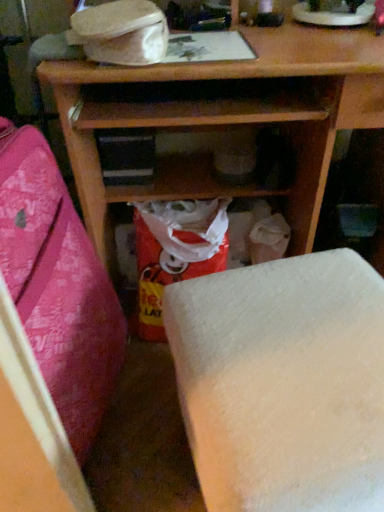
Question: Is matte plastic bag at center surrounded by white matte foam at lower center, which appears as the 2th furniture when viewed from the left?

Choices:
 (A) no
 (B) yes

Answer: (A)

Question: Considering the relative sizes of white matte foam at lower center, placed as the first furniture when sorted from right to left, and matte plastic bag at center in the image provided, is white matte foam at lower center, placed as the first furniture when sorted from right to left, shorter than matte plastic bag at center?

Choices:
 (A) no
 (B) yes

Answer: (A)

Question: Is white matte foam at lower center, placed as the first furniture when sorted from right to left, wider than matte plastic bag at center?

Choices:
 (A) yes
 (B) no

Answer: (A)

Question: Can you confirm if white matte foam at lower center, placed as the first furniture when sorted from right to left, is taller than matte plastic bag at center?

Choices:
 (A) no
 (B) yes

Answer: (B)

Question: Is white matte foam at lower center, placed as the first furniture when sorted from right to left, closer to the viewer compared to matte plastic bag at center?

Choices:
 (A) yes
 (B) no

Answer: (A)

Question: Is matte plastic bag at center spatially inside white matte foam at lower center, which appears as the 2th furniture when viewed from the left, or outside of it?

Choices:
 (A) outside
 (B) inside

Answer: (A)

Question: Considering the relative positions of matte plastic bag at center and white matte foam at lower center, placed as the first furniture when sorted from right to left, in the image provided, is matte plastic bag at center to the left or to the right of white matte foam at lower center, placed as the first furniture when sorted from right to left,?

Choices:
 (A) right
 (B) left

Answer: (B)

Question: Considering the positions of point (168, 252) and point (311, 365), is point (168, 252) closer or farther from the camera than point (311, 365)?

Choices:
 (A) closer
 (B) farther

Answer: (B)

Question: Based on their sizes in the image, would you say matte plastic bag at center is bigger or smaller than white matte foam at lower center, which appears as the 2th furniture when viewed from the left?

Choices:
 (A) small
 (B) big

Answer: (A)

Question: In the image, is wooden shelf at center, which ranks as the 2th furniture in right-to-left order, on the left side or the right side of white matte foam at lower center, placed as the first furniture when sorted from right to left?

Choices:
 (A) left
 (B) right

Answer: (A)

Question: From the image's perspective, is wooden shelf at center, marked as the first furniture in a left-to-right arrangement, above or below white matte foam at lower center, placed as the first furniture when sorted from right to left?

Choices:
 (A) above
 (B) below

Answer: (A)

Question: Relative to white matte foam at lower center, which appears as the 2th furniture when viewed from the left, is wooden shelf at center, marked as the first furniture in a left-to-right arrangement, in front or behind?

Choices:
 (A) behind
 (B) front

Answer: (B)

Question: From a real-world perspective, is wooden shelf at center, which ranks as the 2th furniture in right-to-left order, above or below white matte foam at lower center, placed as the first furniture when sorted from right to left?

Choices:
 (A) above
 (B) below

Answer: (A)

Question: Is matte plastic bag at center spatially inside wooden shelf at center, marked as the first furniture in a left-to-right arrangement, or outside of it?

Choices:
 (A) outside
 (B) inside

Answer: (A)

Question: Looking at the image, does matte plastic bag at center seem bigger or smaller compared to wooden shelf at center, which ranks as the 2th furniture in right-to-left order?

Choices:
 (A) small
 (B) big

Answer: (A)